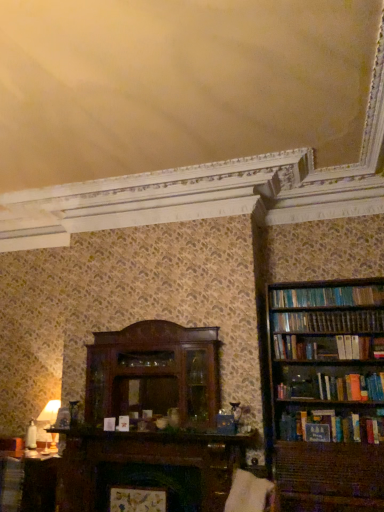
Question: Is matte brown book at lower left facing towards matte white table lamp at left?

Choices:
 (A) yes
 (B) no

Answer: (B)

Question: From a real-world perspective, is matte brown book at lower left beneath matte white table lamp at left?

Choices:
 (A) no
 (B) yes

Answer: (B)

Question: Is matte brown book at lower left thinner than matte white table lamp at left?

Choices:
 (A) no
 (B) yes

Answer: (B)

Question: Considering the relative sizes of matte brown book at lower left and matte white table lamp at left in the image provided, is matte brown book at lower left taller than matte white table lamp at left?

Choices:
 (A) no
 (B) yes

Answer: (A)

Question: From the image's perspective, is matte brown book at lower left located above matte white table lamp at left?

Choices:
 (A) no
 (B) yes

Answer: (A)

Question: From the image's perspective, is wooden bookshelf at right above or below matte white table lamp at left?

Choices:
 (A) above
 (B) below

Answer: (A)

Question: Is wooden bookshelf at right to the left or to the right of matte white table lamp at left in the image?

Choices:
 (A) left
 (B) right

Answer: (B)

Question: Considering the positions of wooden bookshelf at right and matte white table lamp at left in the image, is wooden bookshelf at right taller or shorter than matte white table lamp at left?

Choices:
 (A) short
 (B) tall

Answer: (B)

Question: Is point (283, 368) positioned closer to the camera than point (46, 421)?

Choices:
 (A) closer
 (B) farther

Answer: (A)

Question: From a real-world perspective, is white fabric swivel chair at lower center physically located above or below matte white table lamp at left?

Choices:
 (A) above
 (B) below

Answer: (B)

Question: Is white fabric swivel chair at lower center to the left or to the right of matte white table lamp at left in the image?

Choices:
 (A) right
 (B) left

Answer: (A)

Question: From the image's perspective, is white fabric swivel chair at lower center positioned above or below matte white table lamp at left?

Choices:
 (A) above
 (B) below

Answer: (A)

Question: Is point (274, 501) closer or farther from the camera than point (44, 441)?

Choices:
 (A) closer
 (B) farther

Answer: (A)

Question: Considering the relative positions of matte white table lamp at left and white fabric swivel chair at lower center in the image provided, is matte white table lamp at left to the left or to the right of white fabric swivel chair at lower center?

Choices:
 (A) left
 (B) right

Answer: (A)

Question: Considering the positions of point (41, 434) and point (271, 484), is point (41, 434) closer or farther from the camera than point (271, 484)?

Choices:
 (A) farther
 (B) closer

Answer: (A)